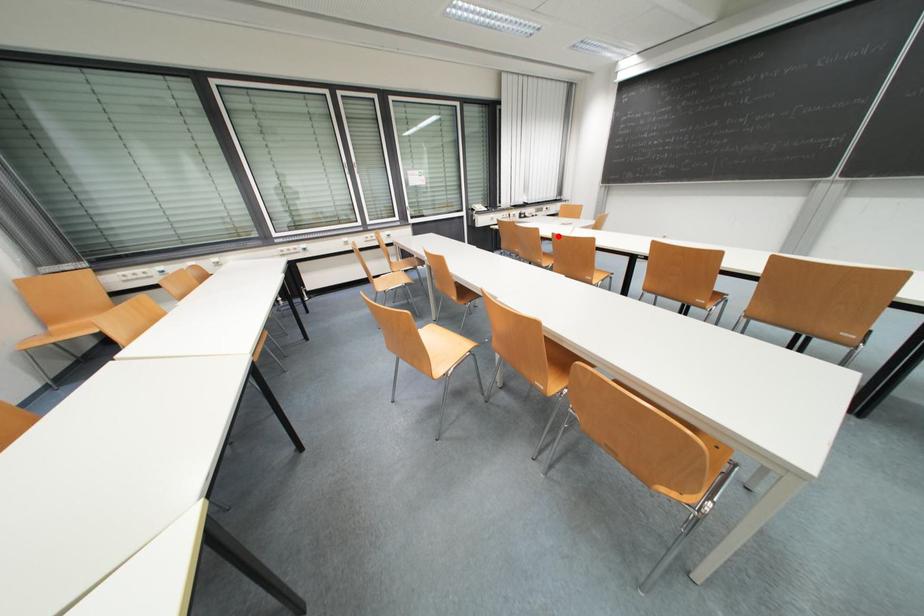
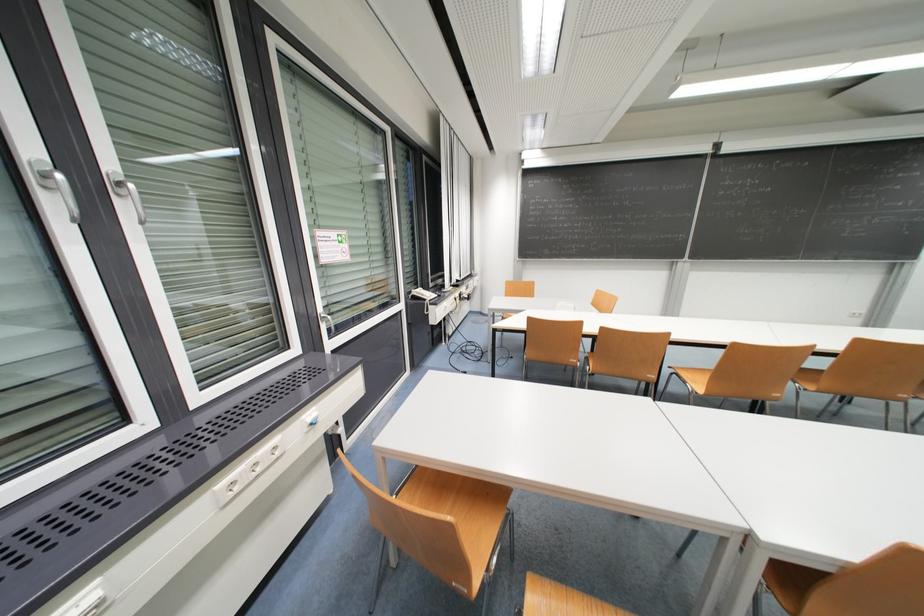
Question: I am providing you with two images of the same scene from different viewpoints. In image1, a red point is highlighted. Considering the same 3D point in image2, which of the following is correct?

Choices:
 (A) It is closer
 (B) It is farther

Answer: (B)